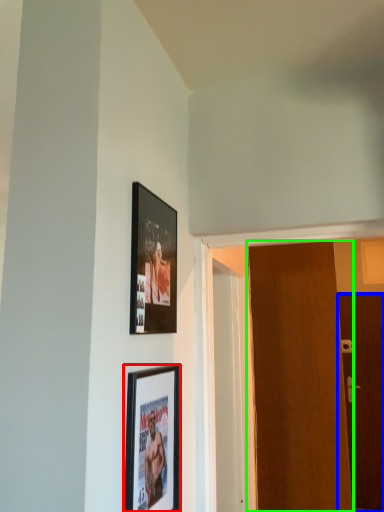
Question: Which is nearer to the picture frame (highlighted by a red box)? door (highlighted by a blue box) or door (highlighted by a green box).

Choices:
 (A) door
 (B) door

Answer: (B)